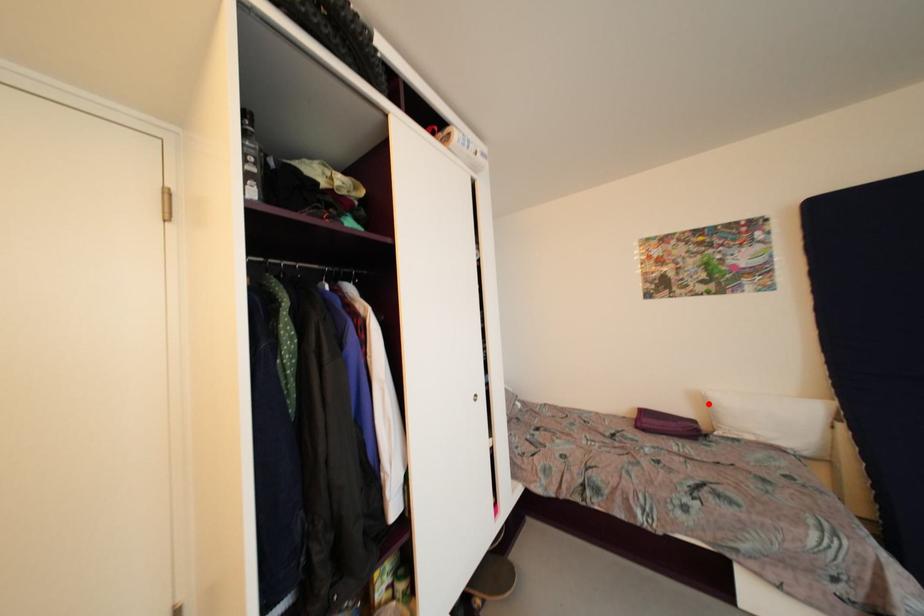
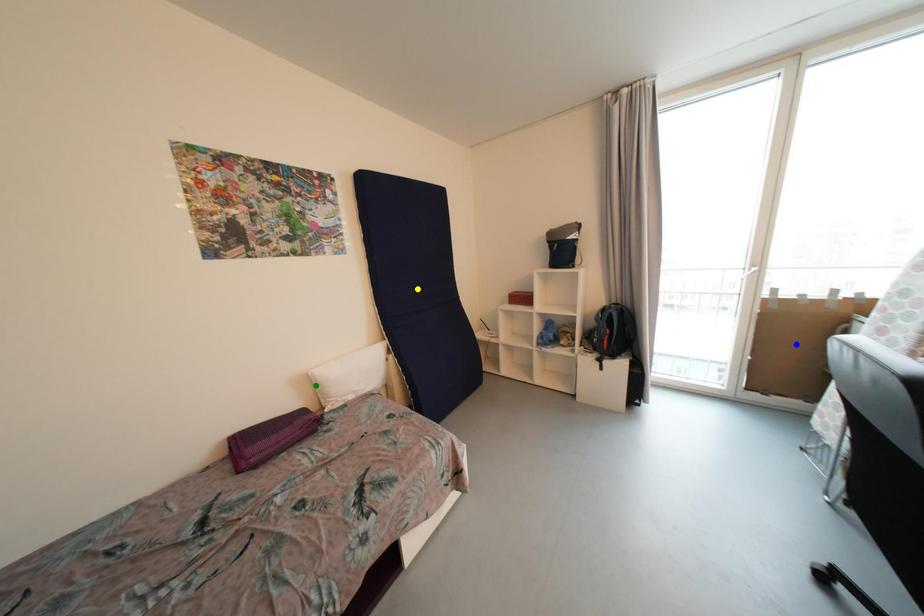
Question: I am providing you with two images of the same scene from different viewpoints. A red point is marked on the first image. You are given multiple points on the second image. Which mark in image 2 goes with the point in image 1?

Choices:
 (A) blue point
 (B) green point
 (C) yellow point

Answer: (B)